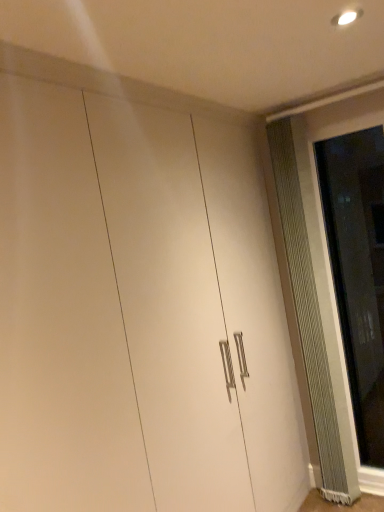
I want to click on metallic ribbed radiator at right, so click(313, 308).

The width and height of the screenshot is (384, 512). Describe the element at coordinates (313, 308) in the screenshot. I see `metallic ribbed radiator at right` at that location.

This screenshot has width=384, height=512. I want to click on clear glass screen door at right, so click(x=358, y=271).

What do you see at coordinates (358, 271) in the screenshot?
I see `clear glass screen door at right` at bounding box center [358, 271].

In order to face clear glass screen door at right, should I rotate leftwards or rightwards?

Rotate right and turn 22.482 degrees.

Measure the distance between clear glass screen door at right and camera.

A distance of 2.15 meters exists between clear glass screen door at right and camera.

This screenshot has width=384, height=512. In order to click on metallic ribbed radiator at right in this screenshot , I will do `click(313, 308)`.

Is clear glass screen door at right to the left of metallic ribbed radiator at right from the viewer's perspective?

Incorrect, clear glass screen door at right is not on the left side of metallic ribbed radiator at right.

Does clear glass screen door at right lie behind metallic ribbed radiator at right?

No, clear glass screen door at right is in front of metallic ribbed radiator at right.

Between point (355, 149) and point (302, 137), which one is positioned behind?

Point (355, 149)

From the image's perspective, which is above, clear glass screen door at right or metallic ribbed radiator at right?

clear glass screen door at right, from the image's perspective.

From a real-world perspective, is clear glass screen door at right beneath metallic ribbed radiator at right?

Yes.

Which object is thinner, clear glass screen door at right or metallic ribbed radiator at right?

Thinner between the two is clear glass screen door at right.

Considering the relative sizes of clear glass screen door at right and metallic ribbed radiator at right in the image provided, is clear glass screen door at right shorter than metallic ribbed radiator at right?

Correct, clear glass screen door at right is not as tall as metallic ribbed radiator at right.

Is clear glass screen door at right smaller than metallic ribbed radiator at right?

Indeed, clear glass screen door at right has a smaller size compared to metallic ribbed radiator at right.

Is metallic ribbed radiator at right completely or partially inside clear glass screen door at right?

No, metallic ribbed radiator at right is not inside clear glass screen door at right.

Would you consider clear glass screen door at right to be distant from metallic ribbed radiator at right?

clear glass screen door at right is actually quite close to metallic ribbed radiator at right.

Is clear glass screen door at right aimed at metallic ribbed radiator at right?

No, clear glass screen door at right is not aimed at metallic ribbed radiator at right.

How different are the orientations of clear glass screen door at right and metallic ribbed radiator at right in degrees?

They differ by 0.0527 degrees in their facing directions.

How distant is clear glass screen door at right from metallic ribbed radiator at right?

clear glass screen door at right and metallic ribbed radiator at right are 15.79 inches apart from each other.

Where is `radiator positioned vertically above the clear glass screen door at right (from a real-world perspective)`? radiator positioned vertically above the clear glass screen door at right (from a real-world perspective) is located at coordinates (313, 308).

Which is more to the right, metallic ribbed radiator at right or clear glass screen door at right?

clear glass screen door at right.

Is the position of metallic ribbed radiator at right more distant than that of clear glass screen door at right?

Yes, metallic ribbed radiator at right is further from the viewer.

Between point (326, 497) and point (376, 253), which one is positioned in front?

Point (326, 497)

From the image's perspective, is metallic ribbed radiator at right under clear glass screen door at right?

Yes, from the image's perspective, metallic ribbed radiator at right is below clear glass screen door at right.

From a real-world perspective, is metallic ribbed radiator at right under clear glass screen door at right?

Incorrect, from a real-world perspective, metallic ribbed radiator at right is higher than clear glass screen door at right.

In terms of width, does metallic ribbed radiator at right look wider or thinner when compared to clear glass screen door at right?

Clearly, metallic ribbed radiator at right has more width compared to clear glass screen door at right.

Which of these two, metallic ribbed radiator at right or clear glass screen door at right, stands shorter?

clear glass screen door at right.

Looking at the image, does metallic ribbed radiator at right seem bigger or smaller compared to clear glass screen door at right?

Clearly, metallic ribbed radiator at right is larger in size than clear glass screen door at right.

Is metallic ribbed radiator at right situated inside clear glass screen door at right or outside?

metallic ribbed radiator at right exists outside the volume of clear glass screen door at right.

Would you say metallic ribbed radiator at right is a long distance from clear glass screen door at right?

No, there isn't a large distance between metallic ribbed radiator at right and clear glass screen door at right.

Is metallic ribbed radiator at right looking in the opposite direction of clear glass screen door at right?

No.

How much distance is there between metallic ribbed radiator at right and clear glass screen door at right?

metallic ribbed radiator at right is 40.10 centimeters away from clear glass screen door at right.

I want to click on screen door below the metallic ribbed radiator at right (from a real-world perspective), so click(x=358, y=271).

The width and height of the screenshot is (384, 512). What are the coordinates of `radiator on the left of clear glass screen door at right` in the screenshot? It's located at (313, 308).

Where is `radiator below the clear glass screen door at right (from the image's perspective)`? The height and width of the screenshot is (512, 384). radiator below the clear glass screen door at right (from the image's perspective) is located at coordinates (313, 308).